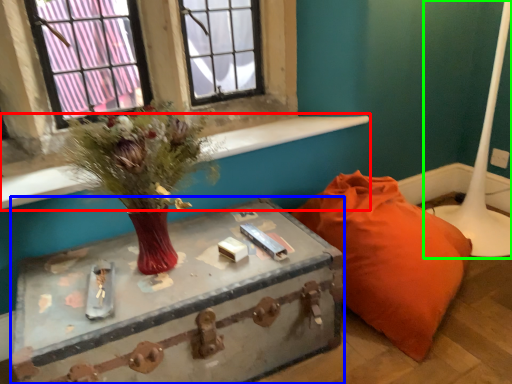
Question: Based on their relative distances, which object is nearer to window sill (highlighted by a red box)? Choose from table (highlighted by a blue box) and table lamp (highlighted by a green box).

Choices:
 (A) table
 (B) table lamp

Answer: (A)